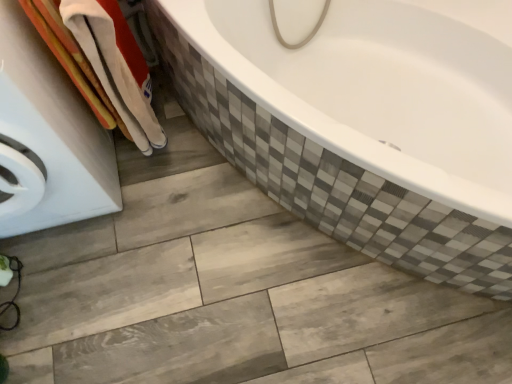
Question: Considering the positions of white glossy washing machine at left and white cotton towel at left in the image, is white glossy washing machine at left taller or shorter than white cotton towel at left?

Choices:
 (A) tall
 (B) short

Answer: (A)

Question: In the image, is white glossy washing machine at left positioned in front of or behind white cotton towel at left?

Choices:
 (A) behind
 (B) front

Answer: (B)

Question: Is point (110, 190) positioned closer to the camera than point (83, 31)?

Choices:
 (A) closer
 (B) farther

Answer: (B)

Question: Is white cotton towel at left in front of or behind white glossy washing machine at left in the image?

Choices:
 (A) behind
 (B) front

Answer: (A)

Question: Considering the positions of white cotton towel at left and white glossy washing machine at left in the image, is white cotton towel at left wider or thinner than white glossy washing machine at left?

Choices:
 (A) wide
 (B) thin

Answer: (B)

Question: From their relative heights in the image, would you say white cotton towel at left is taller or shorter than white glossy washing machine at left?

Choices:
 (A) tall
 (B) short

Answer: (B)

Question: In terms of size, does white cotton towel at left appear bigger or smaller than white glossy washing machine at left?

Choices:
 (A) small
 (B) big

Answer: (A)